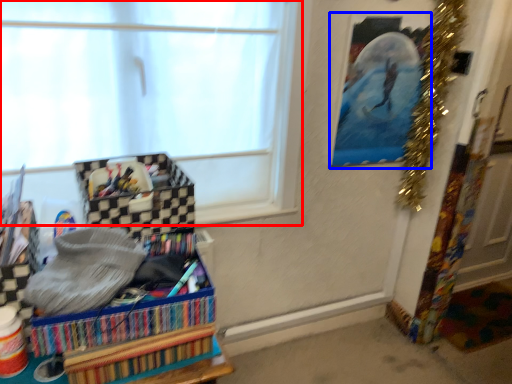
Question: Which of the following is the farthest to the observer, window (highlighted by a red box) or picture frame (highlighted by a blue box)?

Choices:
 (A) window
 (B) picture frame

Answer: (B)